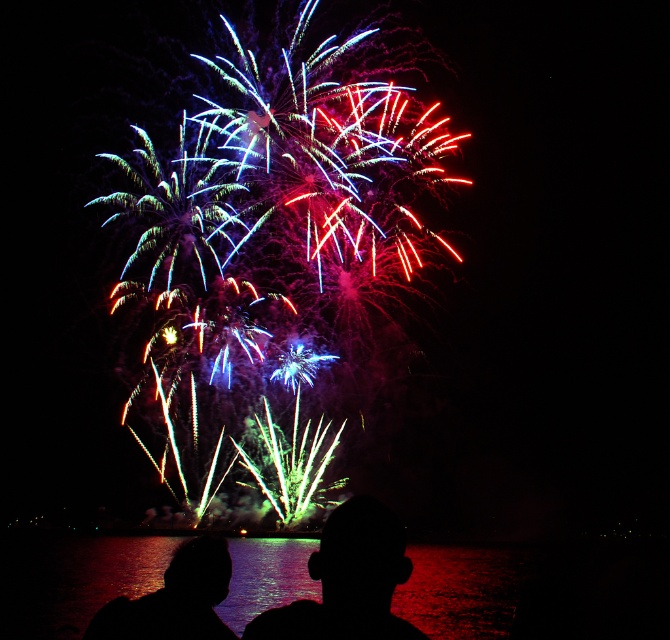
Question: Which point appears farthest from the camera in this image?

Choices:
 (A) (214, 568)
 (B) (352, 509)

Answer: (A)

Question: Can you confirm if silhouette head at center is thinner than silhouette head at lower center?

Choices:
 (A) no
 (B) yes

Answer: (B)

Question: Which point appears farthest from the camera in this image?

Choices:
 (A) (222, 595)
 (B) (409, 632)

Answer: (A)

Question: Can you confirm if silhouette head at center is positioned above silhouette head at lower center?

Choices:
 (A) no
 (B) yes

Answer: (B)

Question: Which point is closer to the camera?

Choices:
 (A) (415, 634)
 (B) (141, 611)

Answer: (A)

Question: Can you confirm if silhouette head at center is smaller than silhouette head at lower center?

Choices:
 (A) yes
 (B) no

Answer: (B)